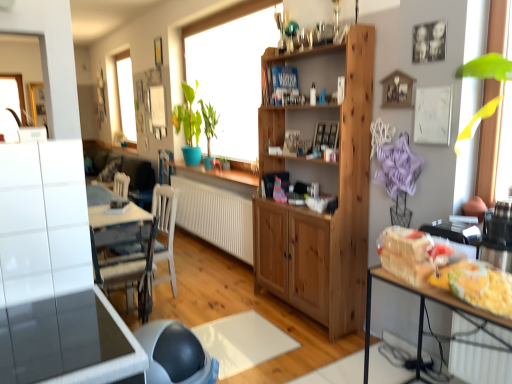
Locate an element on the screen. This screenshot has width=512, height=384. white textured radiator at center is located at coordinates (216, 216).

Identify the location of yellow matte cheese at lower right, which appears as the first food when ordered from the bottom. The width and height of the screenshot is (512, 384). (482, 286).

The image size is (512, 384). Describe the element at coordinates (482, 286) in the screenshot. I see `yellow matte cheese at lower right, which ranks as the 2th food in top-to-bottom order` at that location.

What do you see at coordinates (411, 254) in the screenshot? The image size is (512, 384). I see `translucent plastic bag at right, which appears as the first food when viewed from the top` at bounding box center [411, 254].

The height and width of the screenshot is (384, 512). Find the location of `glossy white table at lower left, positioned as the 1th table in left-to-right order`. glossy white table at lower left, positioned as the 1th table in left-to-right order is located at coordinates (68, 342).

Describe the element at coordinates (232, 71) in the screenshot. The image size is (512, 384). I see `wooden window frame at center` at that location.

In order to click on natural wood cabinet at center in this screenshot , I will do [321, 191].

The image size is (512, 384). I want to click on white textured radiator at center, so click(216, 216).

Is green glossy plant at center further to the viewer compared to natural wood cabinet at center?

Yes, green glossy plant at center is behind natural wood cabinet at center.

From a real-world perspective, is green glossy plant at center above or below natural wood cabinet at center?

green glossy plant at center is above natural wood cabinet at center.

Could you tell me if green glossy plant at center is facing natural wood cabinet at center?

No, green glossy plant at center is not facing towards natural wood cabinet at center.

Which is farther from the camera, (196, 131) or (312, 279)?

The point (196, 131) is more distant.

Consider the image. Is wooden table at right, arranged as the second table when viewed from the left, positioned beyond the bounds of green glossy plant at center?

wooden table at right, arranged as the second table when viewed from the left, lies outside green glossy plant at center's area.

Based on the photo, from a real-world perspective, relative to green glossy plant at center, is wooden table at right, positioned as the 1th table in right-to-left order, vertically above or below?

In terms of real-world spatial position, wooden table at right, positioned as the 1th table in right-to-left order, is below green glossy plant at center.

Which object is more forward, wooden table at right, the first table in the back-to-front sequence, or green glossy plant at center?

wooden table at right, the first table in the back-to-front sequence.

Do you think white matte chair at center is within natural wood cabinet at center, or outside of it?

white matte chair at center exists outside the volume of natural wood cabinet at center.

Considering the sizes of objects white matte chair at center and natural wood cabinet at center in the image provided, who is smaller, white matte chair at center or natural wood cabinet at center?

white matte chair at center.

Is white matte chair at center positioned in front of natural wood cabinet at center?

That is False.

Which of these two, natural wood cabinet at center or wooden table at right, positioned as the 1th table in right-to-left order, stands taller?

Standing taller between the two is natural wood cabinet at center.

From a real-world perspective, is natural wood cabinet at center positioned over wooden table at right, the 2th table positioned from the front, based on gravity?

Yes, from a real-world perspective, natural wood cabinet at center is above wooden table at right, the 2th table positioned from the front.

Is natural wood cabinet at center next to wooden table at right, positioned as the 1th table in right-to-left order, and touching it?

natural wood cabinet at center and wooden table at right, positioned as the 1th table in right-to-left order, are not in contact.

Considering the relative sizes of natural wood cabinet at center and wooden table at right, positioned as the 1th table in right-to-left order, in the image provided, is natural wood cabinet at center thinner than wooden table at right, positioned as the 1th table in right-to-left order,?

Indeed, natural wood cabinet at center has a lesser width compared to wooden table at right, positioned as the 1th table in right-to-left order.

Is white matte chair at center closer to the viewer compared to translucent plastic bag at right, marked as the second food in a bottom-to-top arrangement?

No.

Is there a large distance between white matte chair at center and translucent plastic bag at right, marked as the second food in a bottom-to-top arrangement?

Yes, white matte chair at center and translucent plastic bag at right, marked as the second food in a bottom-to-top arrangement, are quite far apart.

Is white matte chair at center oriented away from translucent plastic bag at right, which appears as the first food when viewed from the top?

white matte chair at center is not turned away from translucent plastic bag at right, which appears as the first food when viewed from the top.

Locate an element on the screen. This screenshot has height=384, width=512. the 1st food to the right when counting from the white matte chair at center is located at coordinates click(411, 254).

Who is more distant, green glossy plant at center or glossy white table at lower left, the first table viewed from the front?

green glossy plant at center.

From a real-world perspective, is green glossy plant at center on top of glossy white table at lower left, the first table viewed from the front?

Yes, from a real-world perspective, green glossy plant at center is over glossy white table at lower left, the first table viewed from the front

Considering the points (185, 109) and (15, 373), which point is in front, point (185, 109) or point (15, 373)?

The point (15, 373) is more forward.

Where is `plant that appears above the glossy white table at lower left, the second table viewed from the back (from the image's perspective)`? plant that appears above the glossy white table at lower left, the second table viewed from the back (from the image's perspective) is located at coordinates (188, 124).

In the scene shown: Between green glossy plant at center and wooden window frame at center, which one is positioned behind?

Positioned behind is green glossy plant at center.

Considering the positions of point (179, 127) and point (275, 24), is point (179, 127) closer or farther from the camera than point (275, 24)?

Point (179, 127) is positioned farther from the camera compared to point (275, 24).

Considering the relative sizes of green glossy plant at center and wooden window frame at center in the image provided, is green glossy plant at center shorter than wooden window frame at center?

Yes.

Consider the image. From the image's perspective, is green glossy plant at center positioned above or below wooden window frame at center?

green glossy plant at center is below wooden window frame at center.

This screenshot has height=384, width=512. What are the coordinates of `plant located behind the natural wood cabinet at center` in the screenshot? It's located at (188, 124).

From the green glossy plant at center, count 2nd table to the right and point to it. Please provide its 2D coordinates.

[(420, 309)]

From the image, which object appears to be nearer to wooden table at right, the 2th table positioned from the front, white matte chair at center or yellow matte cheese at lower right, which ranks as the 2th food in top-to-bottom order?

Among the two, yellow matte cheese at lower right, which ranks as the 2th food in top-to-bottom order, is located nearer to wooden table at right, the 2th table positioned from the front.

From the picture: Estimate the real-world distances between objects in this image. Which object is further from wooden table at right, positioned as the 1th table in right-to-left order, glossy white table at lower left, the second table from the right, or wooden window frame at center?

The object further to wooden table at right, positioned as the 1th table in right-to-left order, is wooden window frame at center.

From the image, which object appears to be farther from green glossy plant at center, natural wood cabinet at center or wooden table at right, arranged as the second table when viewed from the left?

The object further to green glossy plant at center is wooden table at right, arranged as the second table when viewed from the left.

When comparing their distances from wooden table at right, positioned as the 1th table in right-to-left order, does natural wood cabinet at center or wooden window frame at center seem further?

wooden window frame at center.

From the image, which object appears to be farther from wooden window frame at center, natural wood cabinet at center or translucent plastic bag at right, which appears as the first food when viewed from the top?

Among the two, translucent plastic bag at right, which appears as the first food when viewed from the top, is located further to wooden window frame at center.

Which object lies further to the anchor point yellow matte cheese at lower right, which appears as the first food when ordered from the bottom, white matte chair at center or wooden window frame at center?

wooden window frame at center is further to yellow matte cheese at lower right, which appears as the first food when ordered from the bottom.

Considering their positions, is yellow matte cheese at lower right, which ranks as the 2th food in top-to-bottom order, positioned closer to white textured radiator at center than translucent plastic bag at right, marked as the second food in a bottom-to-top arrangement?

Based on the image, translucent plastic bag at right, marked as the second food in a bottom-to-top arrangement, appears to be nearer to white textured radiator at center.

Based on the photo, considering their positions, is white matte chair at center positioned further to translucent plastic bag at right, marked as the second food in a bottom-to-top arrangement, than glossy white table at lower left, the first table viewed from the front?

white matte chair at center is further to translucent plastic bag at right, marked as the second food in a bottom-to-top arrangement.

Locate an element on the screen. This screenshot has width=512, height=384. window between natural wood cabinet at center and green glossy plant at center in the front-back direction is located at coordinates (232, 71).

The width and height of the screenshot is (512, 384). Identify the location of chair positioned between glossy white table at lower left, the second table from the right, and white textured radiator at center from near to far. (165, 229).

Where is `cabinetry that lies between wooden window frame at center and white matte chair at center from top to bottom`? This screenshot has height=384, width=512. cabinetry that lies between wooden window frame at center and white matte chair at center from top to bottom is located at coordinates (321, 191).

This screenshot has height=384, width=512. I want to click on window between glossy white table at lower left, the first table viewed from the front, and green glossy plant at center from front to back, so click(x=232, y=71).